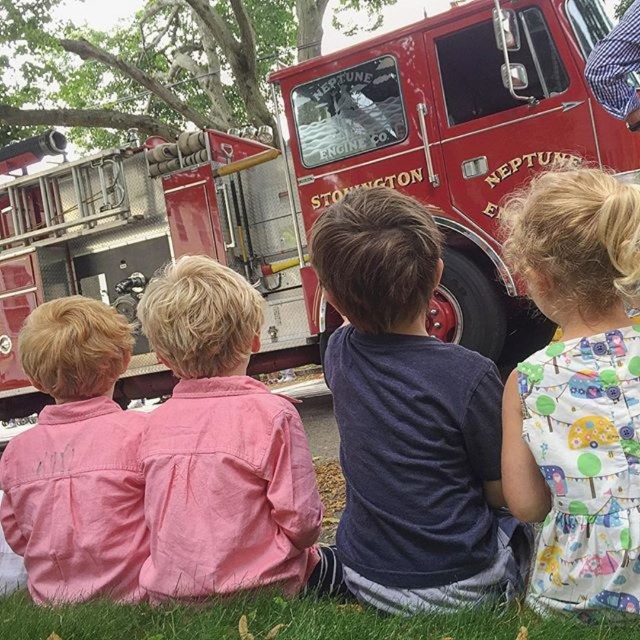
You are a photographer standing at the edge of the scene. You want to take a photo of the printed cotton dress at center without the green grass at lower center appearing in the frame. Based on their distance, is this possible?

The printed cotton dress at center and green grass at lower center are 23.66 inches apart. Since the grass is closer to the dress, you can adjust your camera angle to focus solely on the dress and exclude the grass from the frame.

You are a photographer trying to capture a photo of the shiny red fire truck at center and the pink cotton shirt at left. Since you want both subjects to be clearly visible in the frame, does the height difference between them affect your ability to capture both in one shot?

The shiny red fire truck at center is much taller than the pink cotton shirt at left, so you can easily capture both in one shot as the height difference won

You are a photographer trying to capture a closeup of the pink cotton shirt at center. Based on the coordinates provided in the Objects Description, can you determine if the shirt is positioned in the central area of the image?

The pink cotton shirt at center is located at point coordinates [220,445]. Since the coordinates are given as a point, it is positioned at the center of the image as per the description.